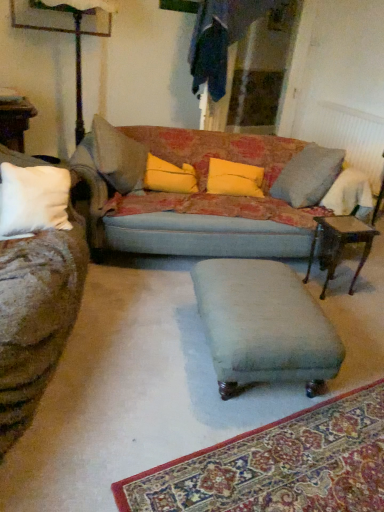
Question: Can you confirm if velvet teal footrest at center is smaller than white textured radiator at upper right?

Choices:
 (A) yes
 (B) no

Answer: (B)

Question: Does velvet teal footrest at center have a lesser height compared to white textured radiator at upper right?

Choices:
 (A) no
 (B) yes

Answer: (B)

Question: Considering the relative sizes of velvet teal footrest at center and white textured radiator at upper right in the image provided, is velvet teal footrest at center thinner than white textured radiator at upper right?

Choices:
 (A) yes
 (B) no

Answer: (B)

Question: Considering the relative positions of velvet teal footrest at center and white textured radiator at upper right in the image provided, is velvet teal footrest at center to the left of white textured radiator at upper right from the viewer's perspective?

Choices:
 (A) no
 (B) yes

Answer: (B)

Question: From the image's perspective, is velvet teal footrest at center above white textured radiator at upper right?

Choices:
 (A) no
 (B) yes

Answer: (A)

Question: Which is correct: white textured radiator at upper right is inside velvet teal footrest at center, or outside of it?

Choices:
 (A) inside
 (B) outside

Answer: (B)

Question: From the image's perspective, relative to velvet teal footrest at center, is white textured radiator at upper right above or below?

Choices:
 (A) above
 (B) below

Answer: (A)

Question: Is white textured radiator at upper right to the left or to the right of velvet teal footrest at center in the image?

Choices:
 (A) right
 (B) left

Answer: (A)

Question: Looking at their shapes, would you say white textured radiator at upper right is wider or thinner than velvet teal footrest at center?

Choices:
 (A) thin
 (B) wide

Answer: (A)

Question: From the image's perspective, is yellow fabric pillow at center, placed as the 2th pillow when sorted from right to left, located above or below white textured radiator at upper right?

Choices:
 (A) above
 (B) below

Answer: (B)

Question: Is yellow fabric pillow at center, placed as the 2th pillow when sorted from right to left, wider or thinner than white textured radiator at upper right?

Choices:
 (A) wide
 (B) thin

Answer: (A)

Question: From their relative heights in the image, would you say yellow fabric pillow at center, which appears as the 1th pillow when viewed from the left, is taller or shorter than white textured radiator at upper right?

Choices:
 (A) tall
 (B) short

Answer: (B)

Question: From a real-world perspective, relative to white textured radiator at upper right, is yellow fabric pillow at center, placed as the 2th pillow when sorted from right to left, vertically above or below?

Choices:
 (A) below
 (B) above

Answer: (B)

Question: Considering the positions of textured fabric couch at center and yellow fabric pillow at center, which ranks as the second pillow in left-to-right order, in the image, is textured fabric couch at center wider or thinner than yellow fabric pillow at center, which ranks as the second pillow in left-to-right order,?

Choices:
 (A) wide
 (B) thin

Answer: (A)

Question: Is textured fabric couch at center situated inside yellow fabric pillow at center, placed as the 1th pillow when sorted from right to left, or outside?

Choices:
 (A) outside
 (B) inside

Answer: (A)